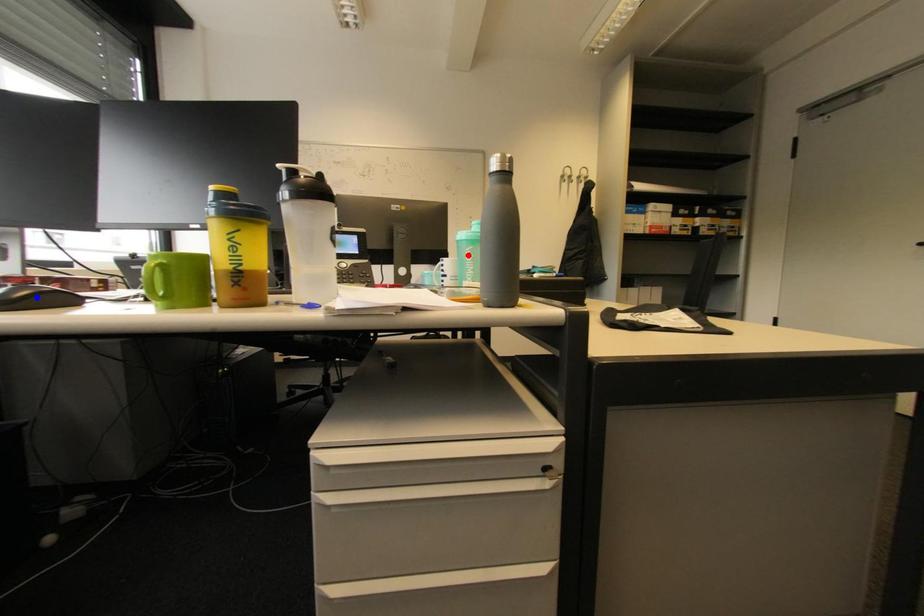
Question: Which of the two points in the image is closer to the camera?

Choices:
 (A) Blue point is closer.
 (B) Red point is closer.

Answer: (A)